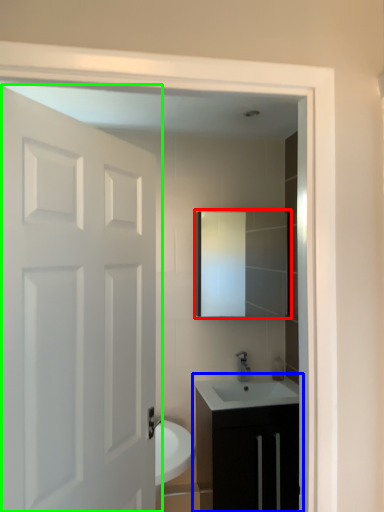
Question: Based on their relative distances, which object is farther from mirror (highlighted by a red box)? Choose from bathroom cabinet (highlighted by a blue box) and door (highlighted by a green box).

Choices:
 (A) bathroom cabinet
 (B) door

Answer: (B)